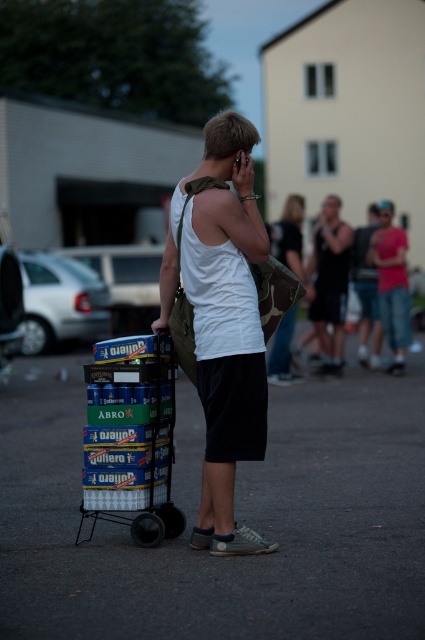
Question: Which of the following is the closest to the observer?

Choices:
 (A) (243, 227)
 (B) (333, 262)

Answer: (A)

Question: Is white matte tank top at center above black tank top at center?

Choices:
 (A) no
 (B) yes

Answer: (A)

Question: Is white matte tank top at center positioned at the back of black tank top at center?

Choices:
 (A) yes
 (B) no

Answer: (B)

Question: Considering the relative positions of white matte tank top at center and blue cardboard trolley at center in the image provided, where is white matte tank top at center located with respect to blue cardboard trolley at center?

Choices:
 (A) left
 (B) right

Answer: (B)

Question: Which object appears closest to the camera in this image?

Choices:
 (A) black tank top at center
 (B) blue cardboard trolley at center

Answer: (B)

Question: Which point is closer to the camera?

Choices:
 (A) black tank top at center
 (B) blue cardboard trolley at center
 (C) white matte tank top at center

Answer: (C)